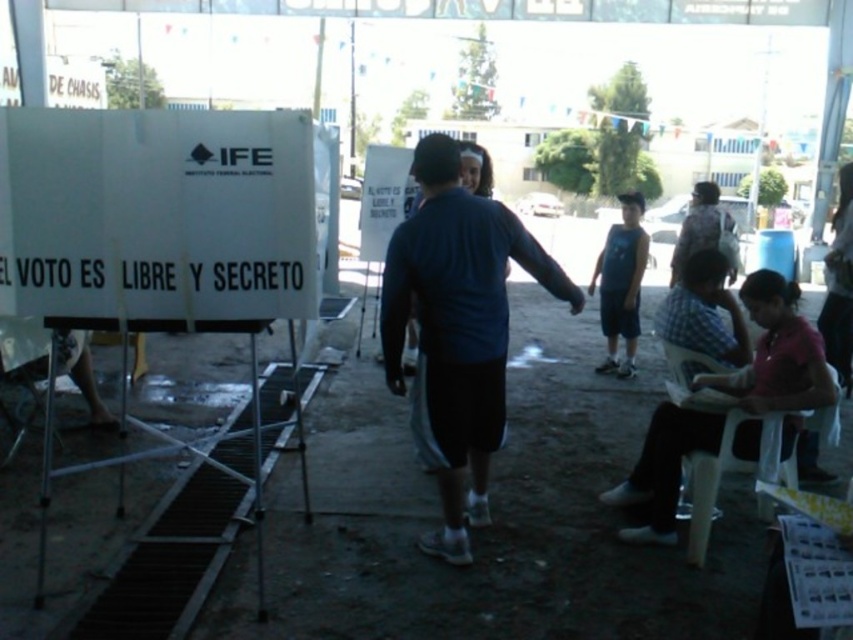
Based on the scene description, where is the dark blue fabric shirt at center located in terms of its 2D coordinates?

The dark blue fabric shirt at center is located at the 2D coordinates point (456, 330).

You are a photographer at the polling station and want to capture both the pink fabric shirt at lower right and the blue cotton shirt at center in a single shot. Based on their positions, which shirt should you adjust to ensure both are fully visible in the frame?

The pink fabric shirt at lower right is to the left of the blue cotton shirt at center. To include both in the frame, you should adjust the blue cotton shirt at center to the right or the pink fabric shirt at lower right to the left.

You are a photographer taking a picture of the polling station. You notice the pink fabric shirt at lower right and the blue cotton shirt at center. Which shirt is positioned lower in the image?

The pink fabric shirt at lower right is positioned lower than the blue cotton shirt at center.